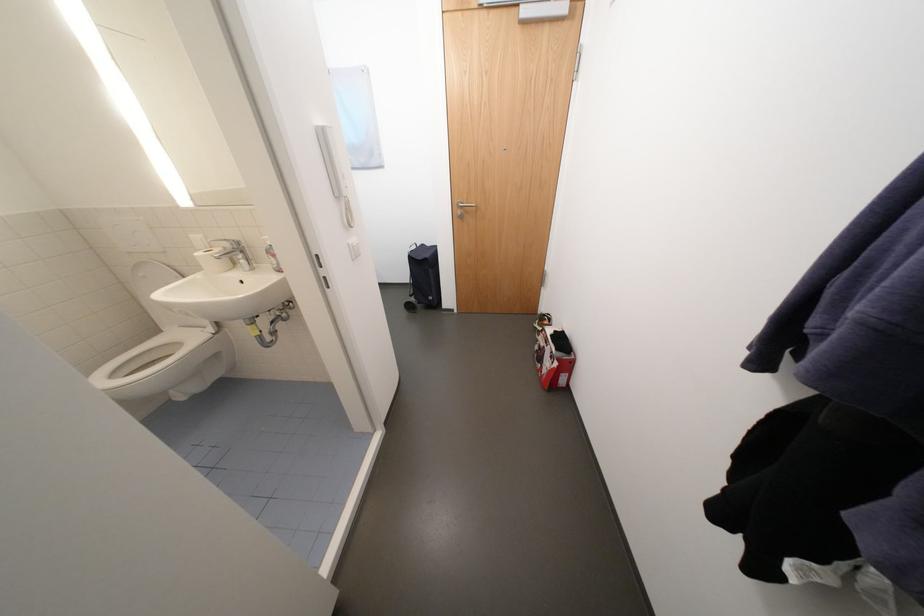
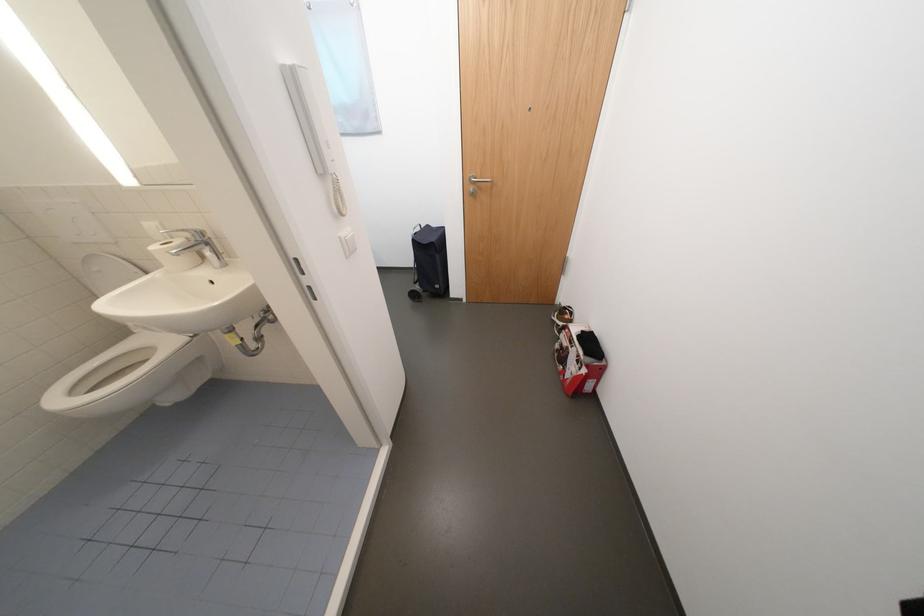
Question: What movement of the cameraman would produce the second image?

Choices:
 (A) Left
 (B) Right
 (C) Forward
 (D) Backward

Answer: (C)